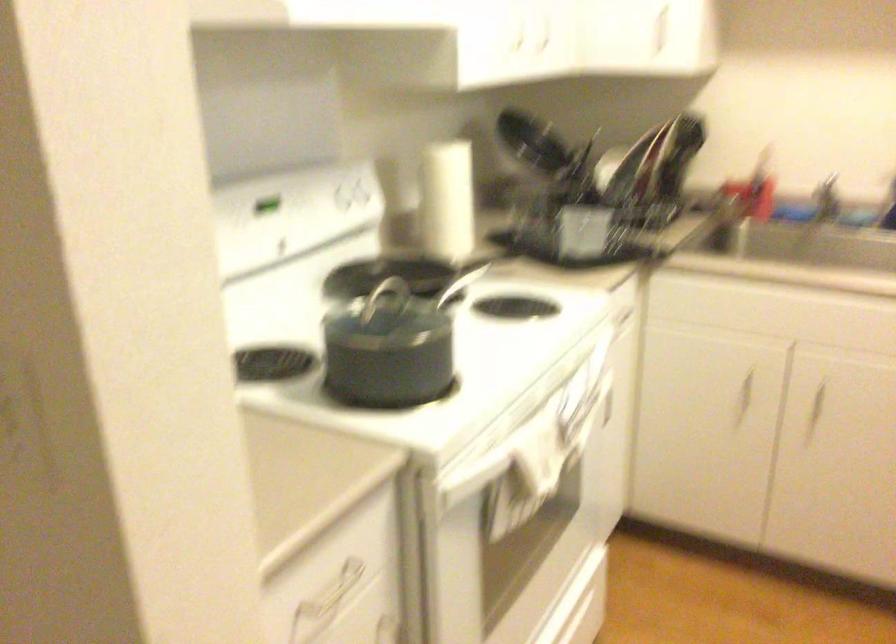
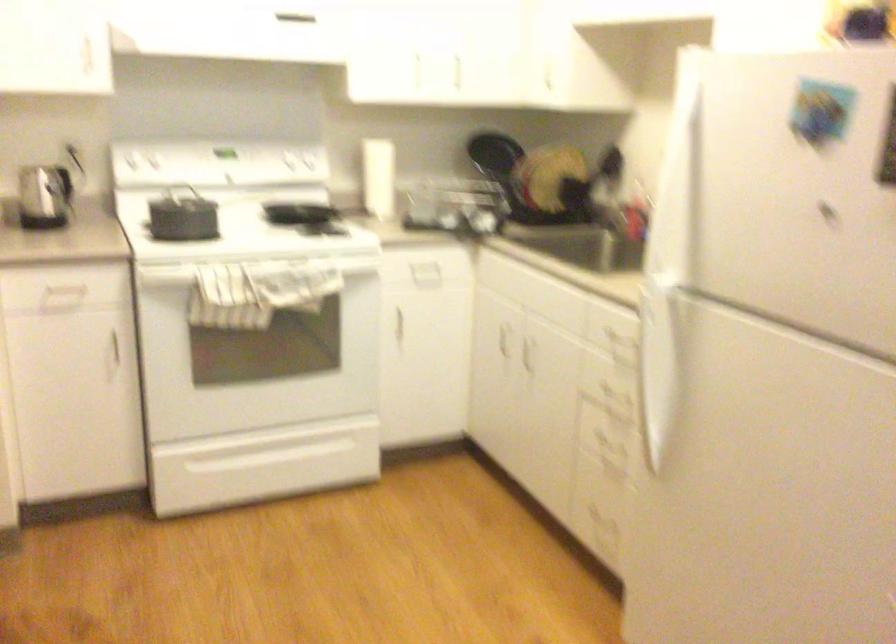
In the second image, find the point that corresponds to point 315,207 in the first image.

(283, 169)